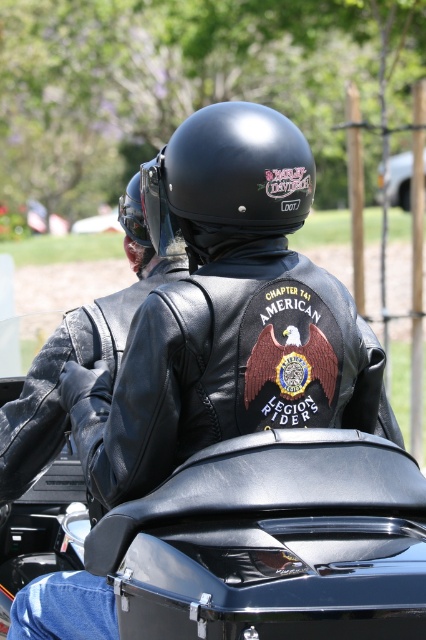
You are standing at a point 2 meters away from the motorcycle. Can you reach the point at coordinates point (x=161, y=426) without moving closer to the motorcycle?

The distance of point (x=161, y=426) from viewer is 3.05 meters. Since you are currently 2 meters away from the motorcycle, you would need to move 1.05 meters closer to reach the point (x=161, y=426).

You are a photographer taking a picture of the riders. You notice the black leather jacket at center and the black matte helmet at center. Which object is more to the right?

The black leather jacket at center is positioned on the right side of the black matte helmet at center, so the black leather jacket at center is more to the right.